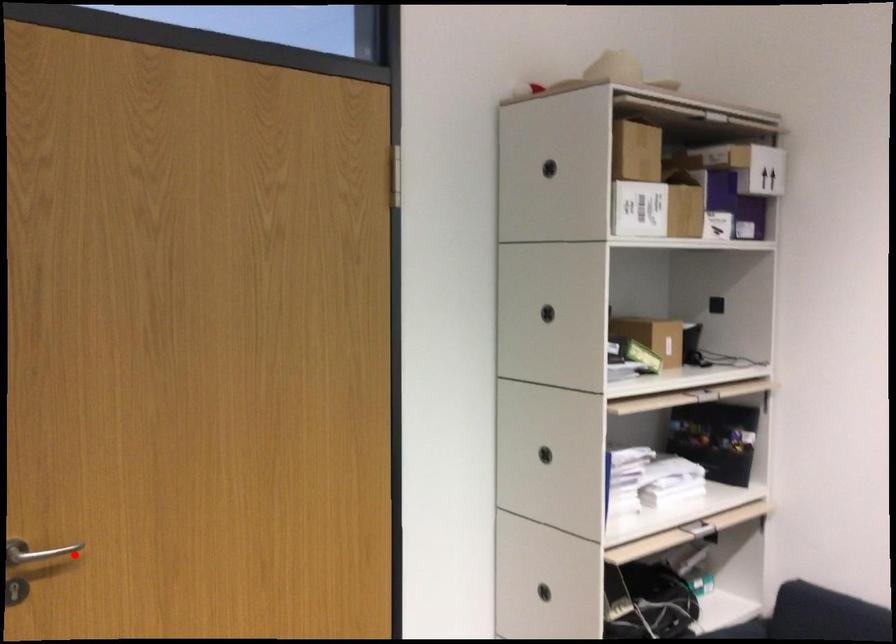
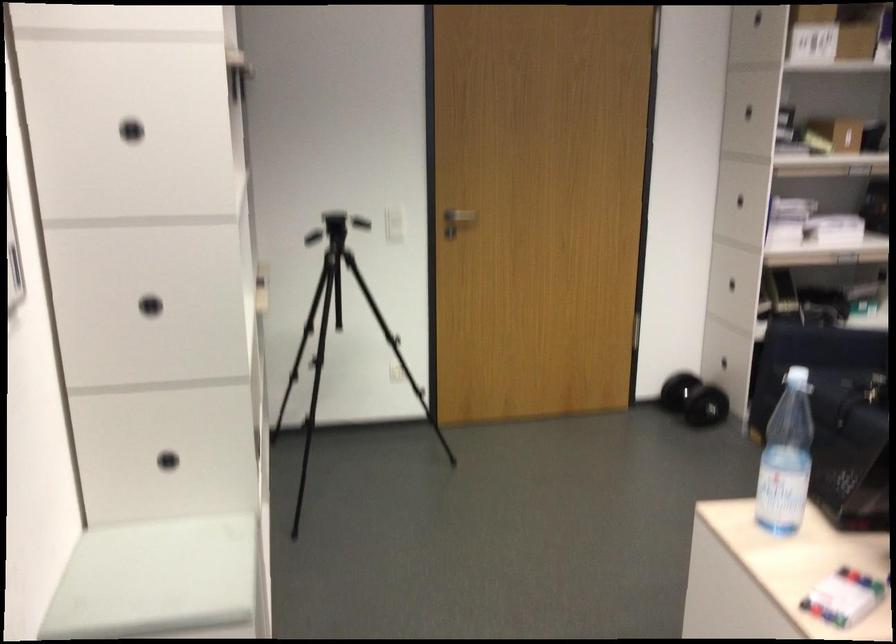
Question: I am providing you with two images of the same scene from different viewpoints. Given a red point in image1, look at the same physical point in image2. Is it:

Choices:
 (A) Closer to the viewpoint
 (B) Farther from the viewpoint

Answer: (B)